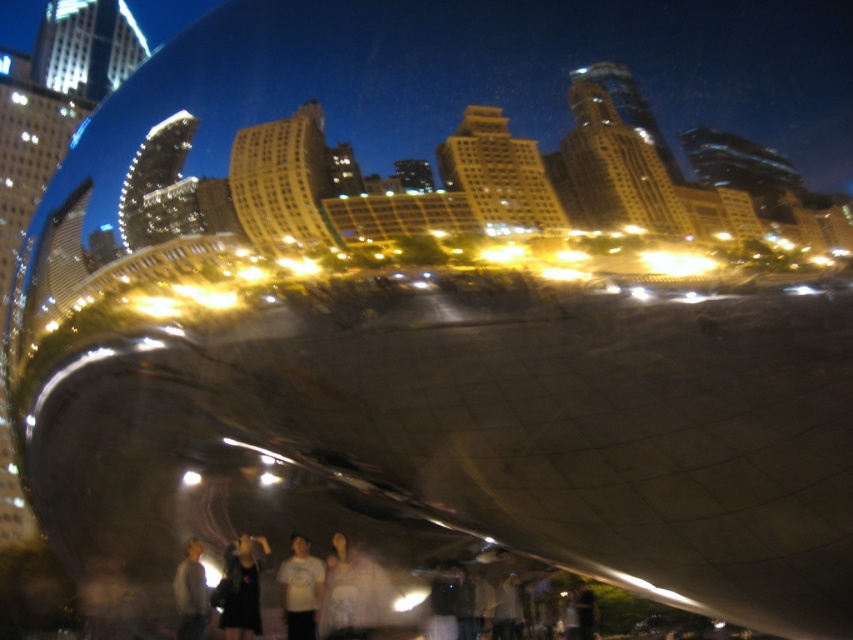
Between dark gray fabric at lower center and white matte t-shirt at center, which one appears on the right side from the viewer's perspective?

white matte t-shirt at center

Does dark gray fabric at lower center have a greater width compared to white matte t-shirt at center?

No, dark gray fabric at lower center is not wider than white matte t-shirt at center.

Where is `dark gray fabric at lower center`? This screenshot has height=640, width=853. dark gray fabric at lower center is located at coordinates (241, 588).

Can you confirm if dark gray fabric at lower center is wider than gray fabric shirt at lower left?

In fact, dark gray fabric at lower center might be narrower than gray fabric shirt at lower left.

Which of these two, dark gray fabric at lower center or gray fabric shirt at lower left, stands taller?

Standing taller between the two is gray fabric shirt at lower left.

Does point (242, 614) lie in front of point (181, 582)?

No, (242, 614) is further to viewer.

I want to click on dark gray fabric at lower center, so click(x=241, y=588).

Between white matte t-shirt at center and gray fabric shirt at lower left, which one is positioned higher?

gray fabric shirt at lower left is higher up.

Is white matte t-shirt at center positioned before gray fabric shirt at lower left?

No, white matte t-shirt at center is behind gray fabric shirt at lower left.

Is point (318, 602) farther from viewer compared to point (204, 600)?

That is True.

Where is `white matte t-shirt at center`? white matte t-shirt at center is located at coordinates (300, 589).